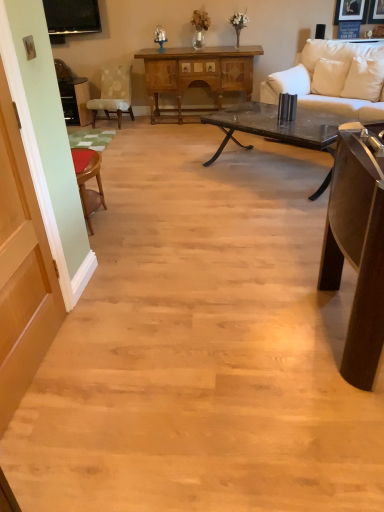
Where is `brown wooden table at left, the third table positioned from the front`? Image resolution: width=384 pixels, height=512 pixels. brown wooden table at left, the third table positioned from the front is located at coordinates (75, 101).

What is the approximate width of dark brown wood table at right, arranged as the 3th table when viewed from the left?

4.63 feet.

The width and height of the screenshot is (384, 512). What do you see at coordinates (114, 93) in the screenshot?
I see `light beige fabric chair at left` at bounding box center [114, 93].

Where is `white leather pillow at upper right, which ranks as the 1th pillow in right-to-left order`? The height and width of the screenshot is (512, 384). white leather pillow at upper right, which ranks as the 1th pillow in right-to-left order is located at coordinates (364, 79).

Which object is positioned more to the right, white leather couch at upper right or white leather pillow at upper right, which ranks as the 1th pillow in right-to-left order?

From the viewer's perspective, white leather pillow at upper right, which ranks as the 1th pillow in right-to-left order, appears more on the right side.

Are white leather couch at upper right and white leather pillow at upper right, which ranks as the 1th pillow in right-to-left order, making contact?

No, white leather couch at upper right is not making contact with white leather pillow at upper right, which ranks as the 1th pillow in right-to-left order.

How different are the orientations of white leather couch at upper right and white leather pillow at upper right, marked as the third pillow in a left-to-right arrangement, in degrees?

The facing directions of white leather couch at upper right and white leather pillow at upper right, marked as the third pillow in a left-to-right arrangement, are 0.000193 degrees apart.

Is point (304, 90) closer to camera compared to point (361, 89)?

Yes.

From a real-world perspective, which object rests below the other?

In real-world perspective, white leather couch at upper right is lower.

Does white leather couch at upper right have a greater height compared to white fabric pillow at upper right, the 2th pillow from the left?

Yes.

Between white leather couch at upper right and white fabric pillow at upper right, the 2th pillow from the left, which one appears on the right side from the viewer's perspective?

From the viewer's perspective, white leather couch at upper right appears more on the right side.

Based on their sizes in the image, would you say white leather couch at upper right is bigger or smaller than white fabric pillow at upper right, the 2th pillow from the left?

In the image, white leather couch at upper right appears to be larger than white fabric pillow at upper right, the 2th pillow from the left.

Is brown wooden table at left, which is counted as the 1th table, starting from the back, facing towards black glass coffee table at center?

No, brown wooden table at left, which is counted as the 1th table, starting from the back, is not aimed at black glass coffee table at center.

Based on the photo, what's the angular difference between brown wooden table at left, which is the first table in left-to-right order, and black glass coffee table at center's facing directions?

brown wooden table at left, which is the first table in left-to-right order, and black glass coffee table at center are facing 43.8 degrees away from each other.

Considering the relative positions of brown wooden table at left, the third table positioned from the front, and black glass coffee table at center in the image provided, is brown wooden table at left, the third table positioned from the front, to the left of black glass coffee table at center from the viewer's perspective?

Yes, brown wooden table at left, the third table positioned from the front, is to the left of black glass coffee table at center.

Where is `chair behind the white fabric pillow at right, marked as the third pillow in a right-to-left arrangement`? chair behind the white fabric pillow at right, marked as the third pillow in a right-to-left arrangement is located at coordinates (114, 93).

Considering the sizes of white fabric pillow at right, marked as the third pillow in a right-to-left arrangement, and light beige fabric chair at left in the image, is white fabric pillow at right, marked as the third pillow in a right-to-left arrangement, wider or thinner than light beige fabric chair at left?

Clearly, white fabric pillow at right, marked as the third pillow in a right-to-left arrangement, has less width compared to light beige fabric chair at left.

Is white fabric pillow at right, the 1th pillow viewed from the left, bigger than light beige fabric chair at left?

Actually, white fabric pillow at right, the 1th pillow viewed from the left, might be smaller than light beige fabric chair at left.

Which of these two, white leather couch at upper right or light beige fabric chair at left, is thinner?

Thinner between the two is light beige fabric chair at left.

Can you confirm if white leather couch at upper right is bigger than light beige fabric chair at left?

Yes.

Is the depth of white leather couch at upper right less than that of light beige fabric chair at left?

Yes, it is in front of light beige fabric chair at left.

Looking at this image, does white leather couch at upper right appear on the left side of light beige fabric chair at left?

No, white leather couch at upper right is not to the left of light beige fabric chair at left.

From the image's perspective, is white leather couch at upper right located above brown wooden table at left, which is the first table in left-to-right order?

Incorrect, from the image's perspective, white leather couch at upper right is lower than brown wooden table at left, which is the first table in left-to-right order.

Identify the location of studio couch below the brown wooden table at left, which is the 2th table from bottom to top (from the image's perspective). (318, 71).

Between white leather couch at upper right and brown wooden table at left, which is the 2th table from bottom to top, which one has larger width?

With larger width is white leather couch at upper right.

Is point (362, 109) positioned before point (72, 122)?

Yes, it is.

Are wooden cabinet at center, the second table viewed from the right, and brown wooden table at left, the third table positioned from the front, beside each other?

wooden cabinet at center, the second table viewed from the right, and brown wooden table at left, the third table positioned from the front, are not in contact.

From the image's perspective, which is above, wooden cabinet at center, the 2th table viewed from the left, or brown wooden table at left, which is the first table in left-to-right order?

wooden cabinet at center, the 2th table viewed from the left, appears higher in the image.

Does wooden cabinet at center, which is counted as the 2th table, starting from the back, have a greater width compared to brown wooden table at left, which is counted as the 1th table, starting from the back?

Correct, the width of wooden cabinet at center, which is counted as the 2th table, starting from the back, exceeds that of brown wooden table at left, which is counted as the 1th table, starting from the back.

I want to click on pillow that is the 1st object located above the white leather couch at upper right (from the image's perspective), so click(x=364, y=79).

At what (x,y) coordinates should I click in order to perform the action: click on studio couch below the white fabric pillow at upper right, acting as the 2th pillow starting from the right (from the image's perspective). Please return your answer as a coordinate pair (x, y). The width and height of the screenshot is (384, 512). Looking at the image, I should click on (318, 71).

Estimate the real-world distances between objects in this image. Which object is closer to white leather pillow at upper right, marked as the third pillow in a left-to-right arrangement, white fabric pillow at upper right, acting as the 2th pillow starting from the right, or wooden cabinet at center, the 2th table viewed from the left?

white fabric pillow at upper right, acting as the 2th pillow starting from the right.

Looking at the image, which one is located closer to white fabric pillow at right, marked as the third pillow in a right-to-left arrangement, dark brown wood table at right, the 1th table when ordered from right to left, or wooden cabinet at center, which ranks as the 1th table in top-to-bottom order?

wooden cabinet at center, which ranks as the 1th table in top-to-bottom order, lies closer to white fabric pillow at right, marked as the third pillow in a right-to-left arrangement, than the other object.

Which object lies further to the anchor point white leather pillow at upper right, which ranks as the 1th pillow in right-to-left order, wooden cabinet at center, the 2th table viewed from the left, or white leather couch at upper right?

wooden cabinet at center, the 2th table viewed from the left.

In the scene shown: Which object lies nearer to the anchor point black glass coffee table at center, dark brown wood table at right, the 1th table when ordered from right to left, or wooden cabinet at center, which is counted as the 2th table, starting from the back?

Based on the image, wooden cabinet at center, which is counted as the 2th table, starting from the back, appears to be nearer to black glass coffee table at center.

From the picture: Based on their spatial positions, is white fabric pillow at right, the 1th pillow viewed from the left, or wooden cabinet at center, the 2th table viewed from the left, further from dark brown wood table at right, placed as the 3th table when sorted from back to front?

Among the two, wooden cabinet at center, the 2th table viewed from the left, is located further to dark brown wood table at right, placed as the 3th table when sorted from back to front.

Which object lies nearer to the anchor point white leather pillow at upper right, which ranks as the 1th pillow in right-to-left order, black glass coffee table at center or dark brown wood table at right, placed as the 3th table when sorted from back to front?

black glass coffee table at center lies closer to white leather pillow at upper right, which ranks as the 1th pillow in right-to-left order, than the other object.

Estimate the real-world distances between objects in this image. Which object is closer to black glass coffee table at center, white fabric pillow at right, the 1th pillow viewed from the left, or brown wooden table at left, which is counted as the 1th table, starting from the back?

white fabric pillow at right, the 1th pillow viewed from the left, is positioned closer to the anchor black glass coffee table at center.

Estimate the real-world distances between objects in this image. Which object is further from wooden cabinet at center, which ranks as the 1th table in top-to-bottom order, brown wooden table at left, which is the 2th table from bottom to top, or dark brown wood table at right, placed as the 3th table when sorted from back to front?

Based on the image, dark brown wood table at right, placed as the 3th table when sorted from back to front, appears to be further to wooden cabinet at center, which ranks as the 1th table in top-to-bottom order.

You are a GUI agent. You are given a task and a screenshot of the screen. Output one action in this format:
    pyautogui.click(x=<x>, y=<y>)
    Task: Click on the table located between transparent glass door at left and white fabric pillow at right, the 1th pillow viewed from the left, in the depth direction
    
    Given the screenshot: What is the action you would take?
    pyautogui.click(x=357, y=248)

This screenshot has height=512, width=384. Find the location of `pillow between dark brown wood table at right, which is the third table in top-to-bottom order, and white fabric pillow at upper right, the 2th pillow from the left, in the front-back direction`. pillow between dark brown wood table at right, which is the third table in top-to-bottom order, and white fabric pillow at upper right, the 2th pillow from the left, in the front-back direction is located at coordinates (364, 79).

Identify the location of chair between brown wooden table at left, which is the first table in left-to-right order, and white fabric pillow at upper right, the 2th pillow from the left, in the horizontal direction. (114, 93).

You are a GUI agent. You are given a task and a screenshot of the screen. Output one action in this format:
    pyautogui.click(x=<x>, y=<y>)
    Task: Click on the table located between transparent glass door at left and black glass coffee table at center in the depth direction
    This screenshot has height=512, width=384.
    Given the screenshot: What is the action you would take?
    pyautogui.click(x=357, y=248)